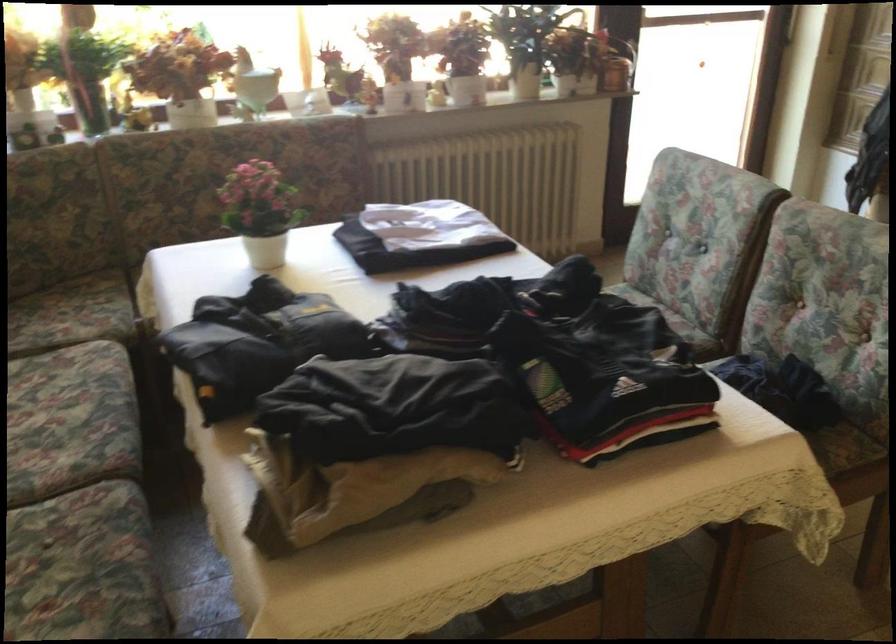
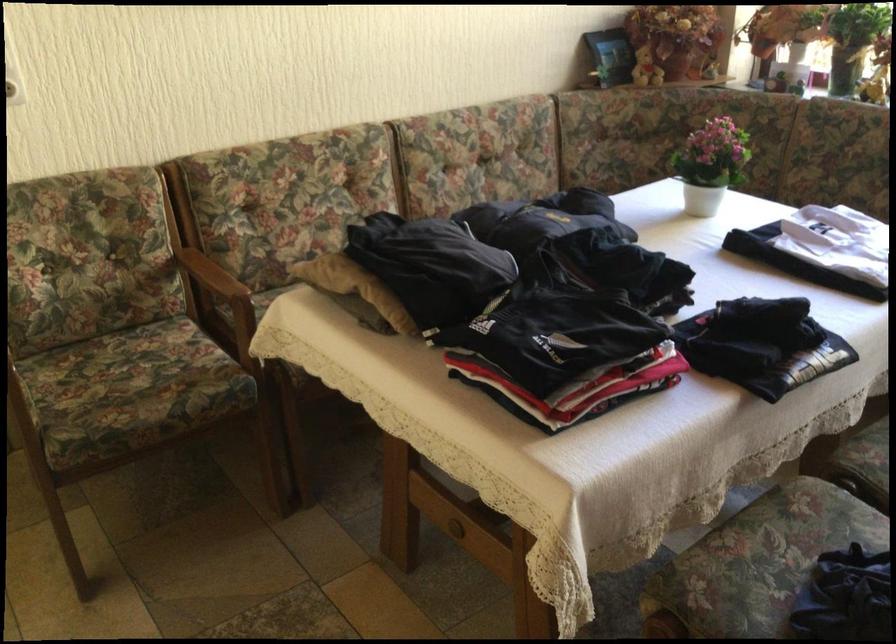
Locate, in the second image, the point that corresponds to point 418,482 in the first image.

(355, 287)